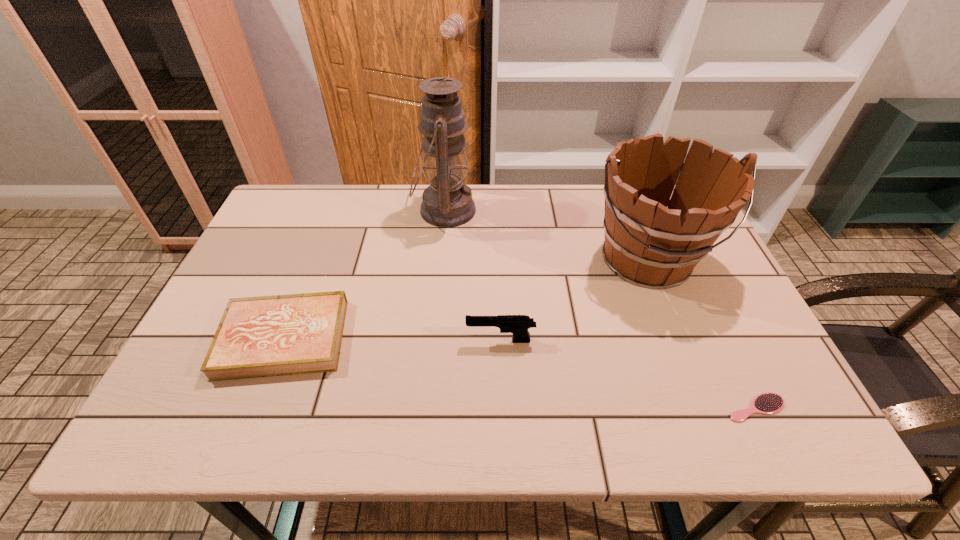
At what (x,y) coordinates should I click in order to perform the action: click on vacant area that lies between the oil lamp and the wine bucket. Please return your answer as a coordinate pair (x, y). Looking at the image, I should click on (545, 235).

Identify the location of free space between the oil lamp and the wine bucket. The width and height of the screenshot is (960, 540). (545, 235).

Find the location of `empty space between the tallest object and the wine bucket`. empty space between the tallest object and the wine bucket is located at coordinates (545, 235).

You are a GUI agent. You are given a task and a screenshot of the screen. Output one action in this format:
    pyautogui.click(x=<x>, y=<y>)
    Task: Click on the free space between the third tallest object and the second tallest object
    This screenshot has width=960, height=540.
    Given the screenshot: What is the action you would take?
    pyautogui.click(x=573, y=300)

Image resolution: width=960 pixels, height=540 pixels. Identify the location of free space between the third tallest object and the second shortest object. (392, 340).

Find the location of a particular element. free space between the leftmost object and the nearest object is located at coordinates (519, 373).

At what (x,y) coordinates should I click in order to perform the action: click on free spot between the tallest object and the fourth shortest object. Please return your answer as a coordinate pair (x, y). The height and width of the screenshot is (540, 960). Looking at the image, I should click on (545, 235).

This screenshot has height=540, width=960. I want to click on object that ranks as the closest to the fourth tallest object, so click(447, 202).

Choose which object is the nearest neighbor to the fourth tallest object. Please provide its 2D coordinates. Your answer should be formatted as a tuple, i.e. [(x, y)], where the tuple contains the x and y coordinates of a point satisfying the conditions above.

[(447, 202)]

This screenshot has height=540, width=960. I want to click on vacant region that satisfies the following two spatial constraints: 1. with the handle on the nearest object; 2. on the left side of the fourth shortest object, so click(704, 408).